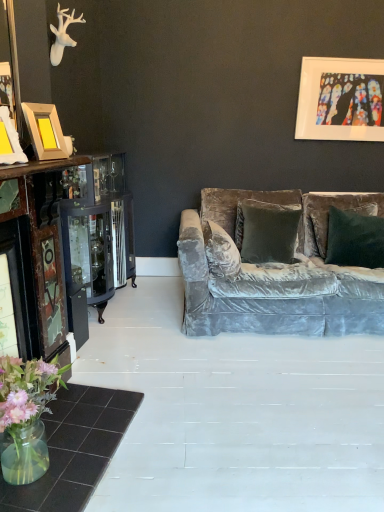
Find the location of `free space above translucent glass vase at lower left (from a real-world perspective)`. free space above translucent glass vase at lower left (from a real-world perspective) is located at coordinates (70, 440).